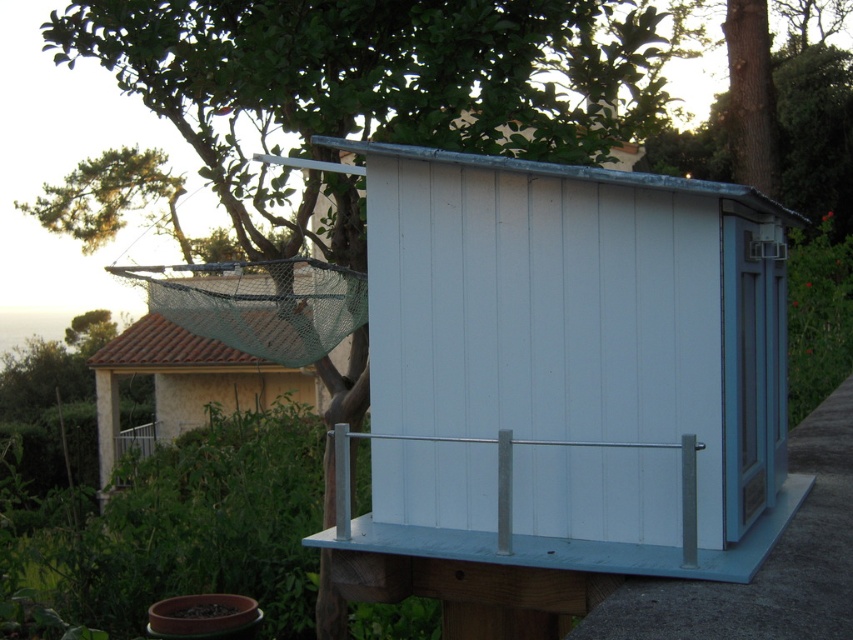
You are a gardener who wants to hang a new bird feeder. You see the white wood shed at center and the green mesh net at upper left. Which object is located above the other?

The white wood shed at center is positioned over the green mesh net at upper left, meaning it is above the net.

You are a bird trying to land on the silver metallic rail at center. From your perspective, is the white wood shed at center blocking your view of the rail?

The white wood shed at center is in front of the silver metallic rail at center, so yes, the shed is blocking your view of the rail.